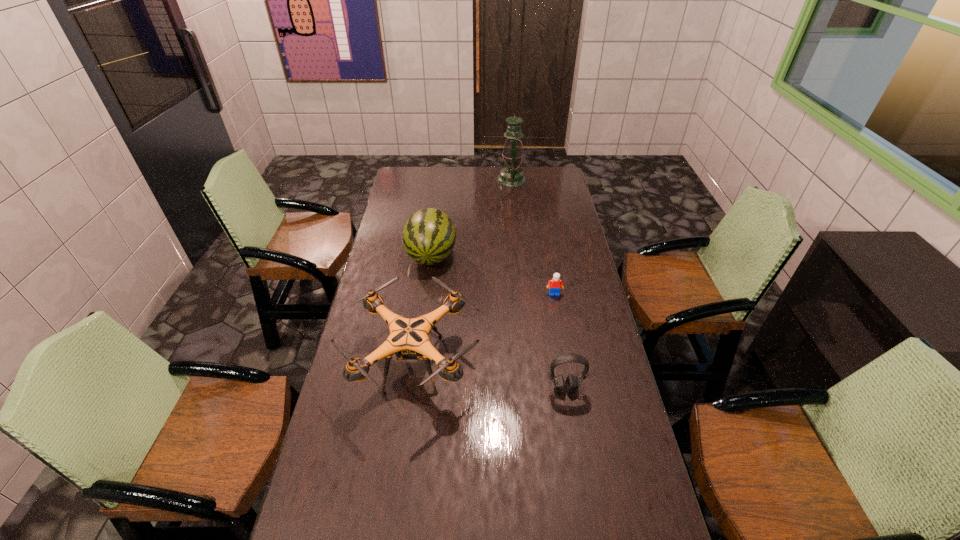
Identify the location of the tallest object. (511, 176).

The image size is (960, 540). I want to click on oil lamp, so click(511, 176).

Image resolution: width=960 pixels, height=540 pixels. I want to click on the second farthest object, so click(x=428, y=238).

Identify the location of drone. This screenshot has height=540, width=960. (408, 339).

Where is `the second shortest object`? the second shortest object is located at coordinates (571, 383).

You are a GUI agent. You are given a task and a screenshot of the screen. Output one action in this format:
    pyautogui.click(x=<x>, y=<y>)
    Task: Click on the third farthest object
    This screenshot has height=540, width=960.
    Given the screenshot: What is the action you would take?
    pyautogui.click(x=555, y=284)

Find the location of a particular element. Image resolution: width=960 pixels, height=540 pixels. Lego is located at coordinates (555, 284).

This screenshot has height=540, width=960. Find the location of `vacant area situated 0.180m on the left of the farthest object`. vacant area situated 0.180m on the left of the farthest object is located at coordinates (463, 180).

The image size is (960, 540). I want to click on free space located at the stem end of the fourth nearest object, so click(x=426, y=298).

Identify the location of free spot located on the camera mount of the drone. (552, 363).